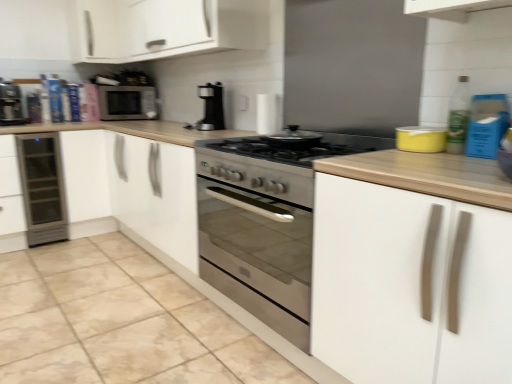
This screenshot has height=384, width=512. Identify the location of free space in front of yellow matte container at upper right, which is counted as the first appliance, starting from the right. (439, 153).